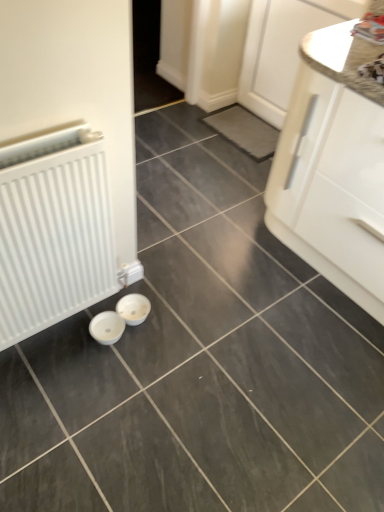
Question: From the image's perspective, would you say white matte radiator at left is positioned over white glossy cabinet at upper right, which appears as the first cabinetry when viewed from the top?

Choices:
 (A) yes
 (B) no

Answer: (B)

Question: Would you say white matte radiator at left is a long distance from white glossy cabinet at upper right, which appears as the first cabinetry when viewed from the top?

Choices:
 (A) no
 (B) yes

Answer: (B)

Question: From a real-world perspective, is white matte radiator at left located higher than white glossy cabinet at upper right, which appears as the first cabinetry when viewed from the top?

Choices:
 (A) no
 (B) yes

Answer: (A)

Question: Considering the relative sizes of white matte radiator at left and white glossy cabinet at upper right, which appears as the first cabinetry when viewed from the top, in the image provided, is white matte radiator at left bigger than white glossy cabinet at upper right, which appears as the first cabinetry when viewed from the top,?

Choices:
 (A) yes
 (B) no

Answer: (B)

Question: Is white matte radiator at left positioned with its back to white glossy cabinet at upper right, the 2th cabinetry when ordered from bottom to top?

Choices:
 (A) yes
 (B) no

Answer: (B)

Question: Is white glossy cabinet at right, the 1th cabinetry when ordered from bottom to top, spatially inside white matte radiator at left, or outside of it?

Choices:
 (A) inside
 (B) outside

Answer: (B)

Question: Considering the relative positions of white glossy cabinet at right, marked as the second cabinetry in a top-to-bottom arrangement, and white matte radiator at left in the image provided, is white glossy cabinet at right, marked as the second cabinetry in a top-to-bottom arrangement, to the left or to the right of white matte radiator at left?

Choices:
 (A) right
 (B) left

Answer: (A)

Question: Relative to white matte radiator at left, is white glossy cabinet at right, marked as the second cabinetry in a top-to-bottom arrangement, in front or behind?

Choices:
 (A) front
 (B) behind

Answer: (B)

Question: In terms of width, does white glossy cabinet at right, the 1th cabinetry when ordered from bottom to top, look wider or thinner when compared to white matte radiator at left?

Choices:
 (A) wide
 (B) thin

Answer: (A)

Question: From a real-world perspective, is white glossy cabinet at upper right, the 2th cabinetry when ordered from bottom to top, above or below white glossy cabinet at right, marked as the second cabinetry in a top-to-bottom arrangement?

Choices:
 (A) below
 (B) above

Answer: (A)

Question: Is white glossy cabinet at upper right, which appears as the first cabinetry when viewed from the top, inside or outside of white glossy cabinet at right, the 1th cabinetry when ordered from bottom to top?

Choices:
 (A) outside
 (B) inside

Answer: (A)

Question: Relative to white glossy cabinet at right, marked as the second cabinetry in a top-to-bottom arrangement, is white glossy cabinet at upper right, which appears as the first cabinetry when viewed from the top, in front or behind?

Choices:
 (A) behind
 (B) front

Answer: (A)

Question: Considering the positions of white glossy cabinet at upper right, which appears as the first cabinetry when viewed from the top, and white glossy cabinet at right, marked as the second cabinetry in a top-to-bottom arrangement, in the image, is white glossy cabinet at upper right, which appears as the first cabinetry when viewed from the top, wider or thinner than white glossy cabinet at right, marked as the second cabinetry in a top-to-bottom arrangement,?

Choices:
 (A) thin
 (B) wide

Answer: (A)

Question: Is white glossy cabinet at upper right, which appears as the first cabinetry when viewed from the top, wider or thinner than white matte radiator at left?

Choices:
 (A) wide
 (B) thin

Answer: (B)

Question: Considering their positions, is white glossy cabinet at upper right, which appears as the first cabinetry when viewed from the top, located in front of or behind white matte radiator at left?

Choices:
 (A) front
 (B) behind

Answer: (B)